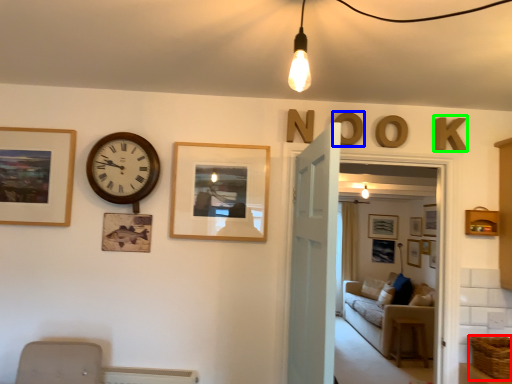
Question: Considering the real-world distances, which object is closest to basket (highlighted by a red box)? letter (highlighted by a blue box) or letter (highlighted by a green box).

Choices:
 (A) letter
 (B) letter

Answer: (B)